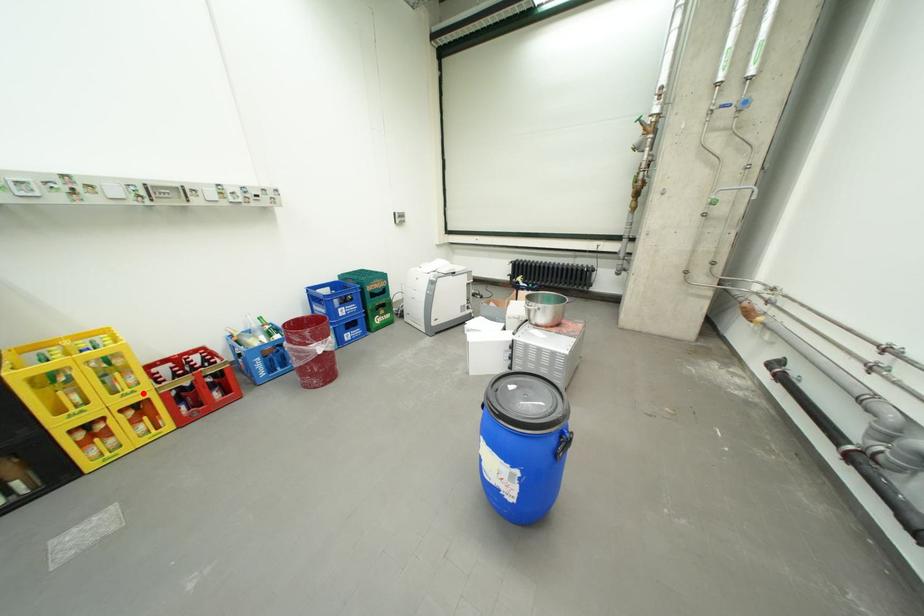
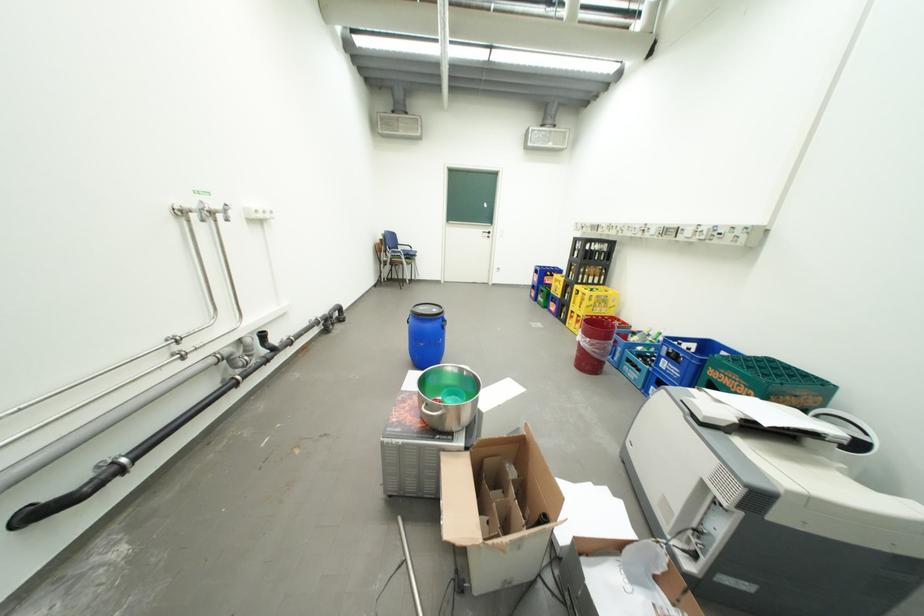
In the second image, find the point that corresponds to the highlighted location in the first image.

(590, 312)